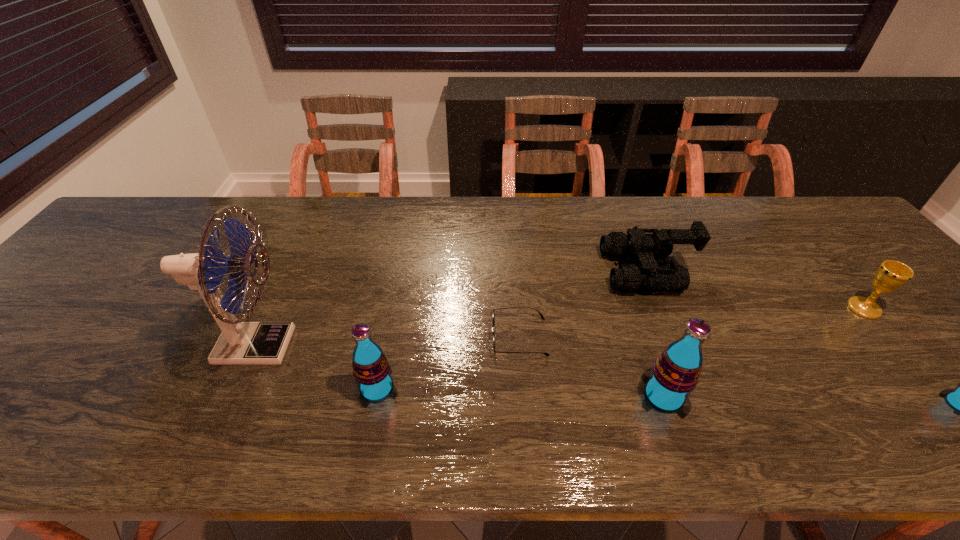
Identify the location of vacant space situated on the back of the second soda from right to left. (625, 282).

Where is `vacant area situated on the front lenses of the binoculars`? The height and width of the screenshot is (540, 960). vacant area situated on the front lenses of the binoculars is located at coordinates [x=484, y=271].

Image resolution: width=960 pixels, height=540 pixels. I want to click on blank space located 0.260m on the front lenses of the binoculars, so click(510, 271).

I want to click on vacant space situated on the front lenses of the binoculars, so click(576, 271).

At what (x,y) coordinates should I click in order to perform the action: click on vacant space located on the front of the chalice. Please return your answer as a coordinate pair (x, y). Looking at the image, I should click on (937, 396).

Image resolution: width=960 pixels, height=540 pixels. Identify the location of free region located on the front-facing side of the third object from left to right. (364, 337).

Find the location of a particular element. vacant space located 0.140m on the front-facing side of the third object from left to right is located at coordinates (432, 337).

At what (x,y) coordinates should I click in order to perform the action: click on vacant space located on the front-facing side of the third object from left to right. Please return your answer as a coordinate pair (x, y). This screenshot has height=540, width=960. Looking at the image, I should click on (411, 337).

Identify the location of vacant space located 0.100m on the front-facing side of the leftmost object. The image size is (960, 540). (340, 346).

Where is `fan positioned at the near edge`? The width and height of the screenshot is (960, 540). fan positioned at the near edge is located at coordinates (241, 343).